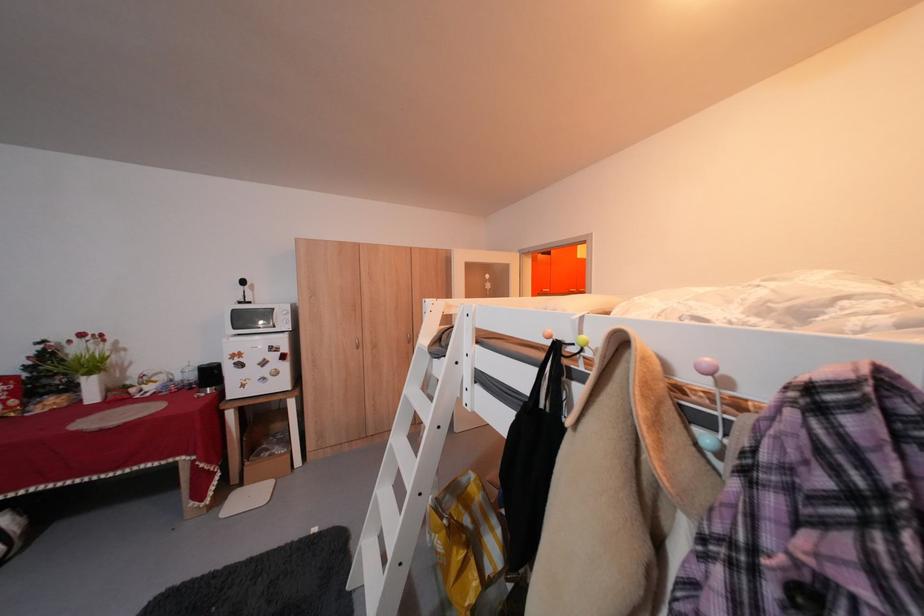
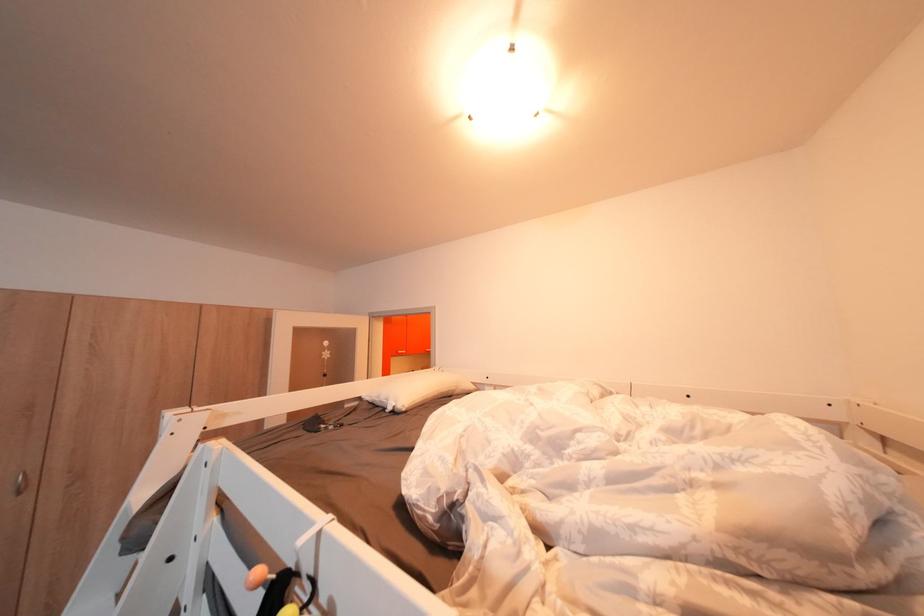
The point at (448, 342) is marked in the first image. Where is the corresponding point in the second image?

(179, 493)